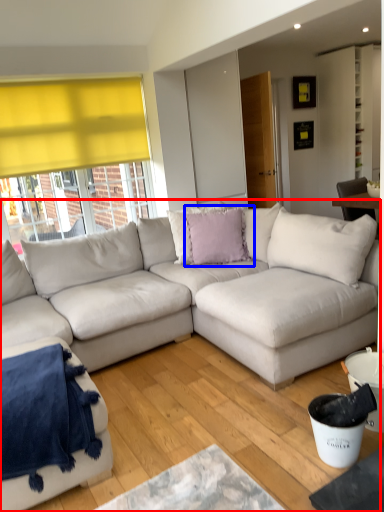
Question: Among these objects, which one is farthest to the camera, studio couch (highlighted by a red box) or pillow (highlighted by a blue box)?

Choices:
 (A) studio couch
 (B) pillow

Answer: (B)